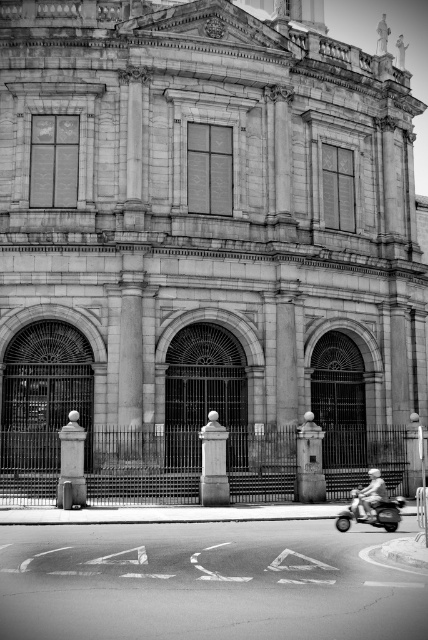
Question: Among these points, which one is nearest to the camera?

Choices:
 (A) (353, 488)
 (B) (369, 490)

Answer: (B)

Question: Does shiny metallic motorcycle at lower right appear on the right side of light brown leather jacket at lower right?

Choices:
 (A) no
 (B) yes

Answer: (A)

Question: Does shiny metallic motorcycle at lower right have a greater width compared to light brown leather jacket at lower right?

Choices:
 (A) yes
 (B) no

Answer: (A)

Question: Is shiny metallic motorcycle at lower right smaller than light brown leather jacket at lower right?

Choices:
 (A) no
 (B) yes

Answer: (B)